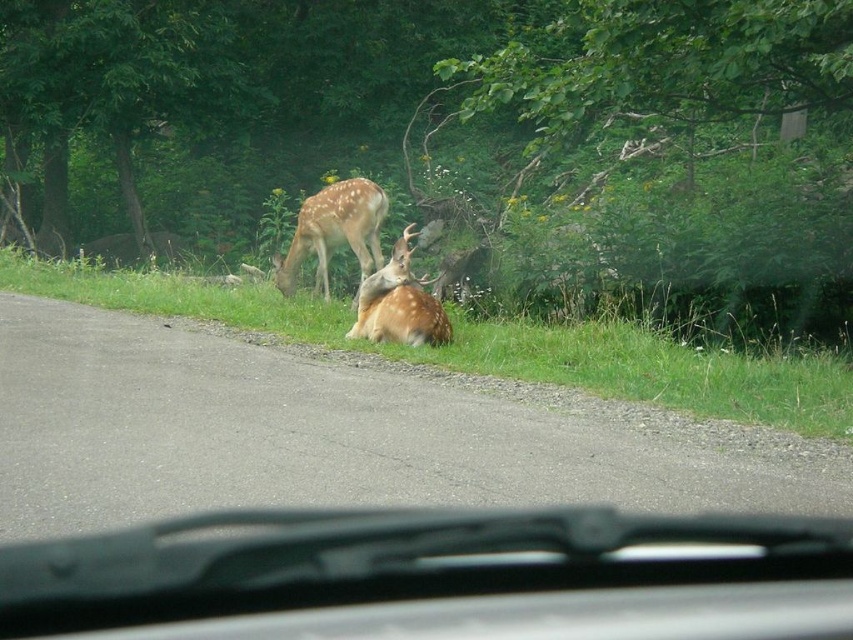
Does transparent rubber windshield wiper at lower center have a greater height compared to fawn fur antlers at center?

No, transparent rubber windshield wiper at lower center is not taller than fawn fur antlers at center.

Locate an element on the screen. transparent rubber windshield wiper at lower center is located at coordinates (437, 577).

Between point (761, 604) and point (386, 336), which one is positioned in front?

Positioned in front is point (761, 604).

Where is `transparent rubber windshield wiper at lower center`? This screenshot has width=853, height=640. transparent rubber windshield wiper at lower center is located at coordinates (437, 577).

This screenshot has width=853, height=640. Describe the element at coordinates (335, 230) in the screenshot. I see `spotted fur deer at center` at that location.

Is point (379, 252) positioned before point (422, 323)?

No, (379, 252) is further to viewer.

Locate an element on the screen. spotted fur deer at center is located at coordinates (335, 230).

Based on the photo, can you confirm if transparent rubber windshield wiper at lower center is shorter than green grass at lower center?

Yes.

Does transparent rubber windshield wiper at lower center have a greater height compared to green grass at lower center?

Incorrect, transparent rubber windshield wiper at lower center's height is not larger of green grass at lower center's.

Does point (376, 563) come farther from viewer compared to point (637, 353)?

No, it is not.

This screenshot has height=640, width=853. What are the coordinates of `transparent rubber windshield wiper at lower center` in the screenshot? It's located at (437, 577).